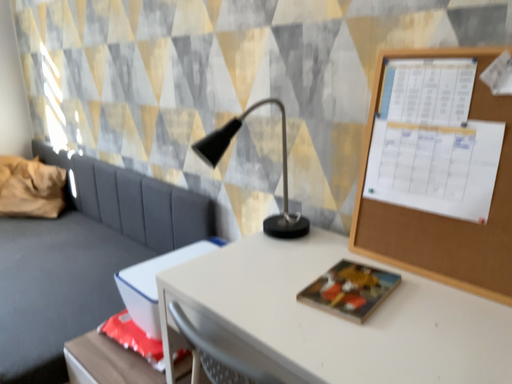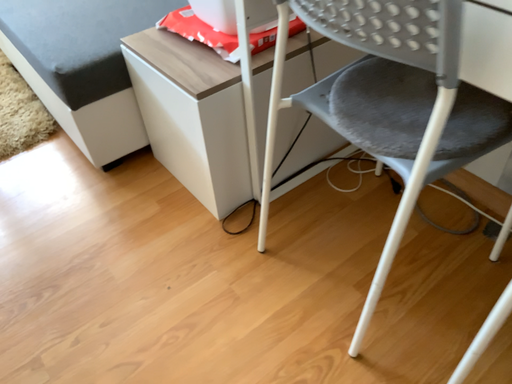
Question: How did the camera likely rotate when shooting the video?

Choices:
 (A) rotated downward
 (B) rotated upward

Answer: (A)